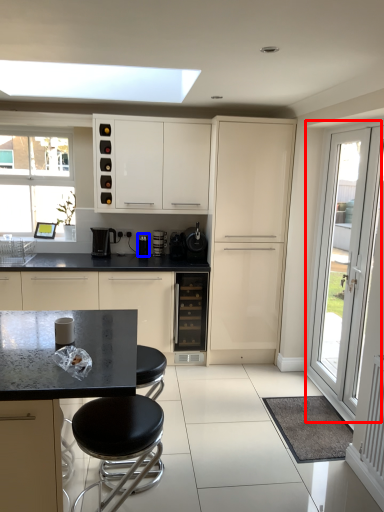
Question: Which point is closer to the camera, door (highlighted by a red box) or appliance (highlighted by a blue box)?

Choices:
 (A) door
 (B) appliance

Answer: (A)